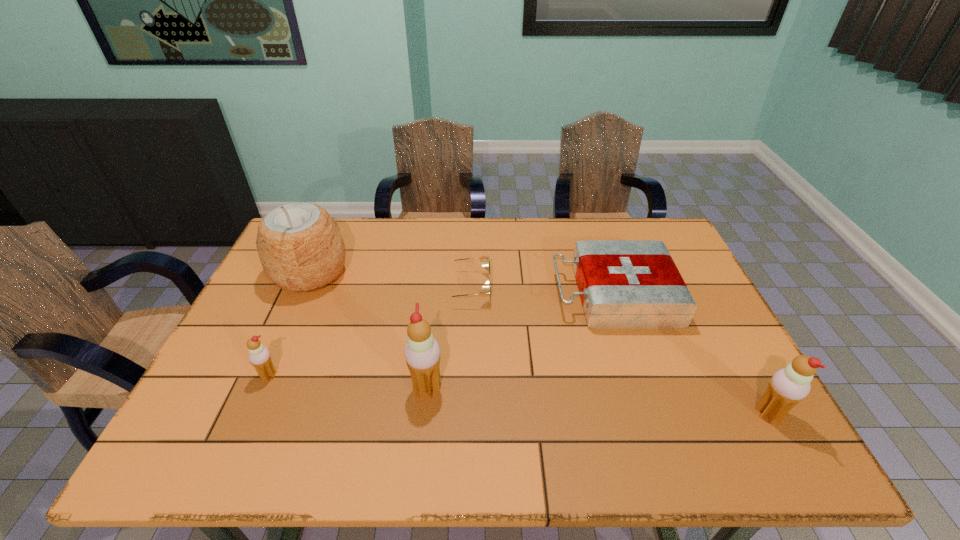
Where is `vacant space situated 0.310m at the front with a straw on the rightmost icecream`? vacant space situated 0.310m at the front with a straw on the rightmost icecream is located at coordinates (616, 414).

The height and width of the screenshot is (540, 960). I want to click on free space located at the front with a straw on the rightmost icecream, so 652,414.

Identify the location of vacant space located 0.370m at the front with a straw on the rightmost icecream. (589, 414).

The width and height of the screenshot is (960, 540). Find the location of `vacant space located on the front lenses of the shortest object`. vacant space located on the front lenses of the shortest object is located at coordinates (601, 288).

This screenshot has width=960, height=540. Find the location of `vacant area situated on the right of the tallest object`. vacant area situated on the right of the tallest object is located at coordinates (407, 274).

In order to click on vacant space situated on the front side of the first-aid kit in this screenshot , I will do `click(534, 294)`.

The height and width of the screenshot is (540, 960). Find the location of `vacant space located on the front side of the first-aid kit`. vacant space located on the front side of the first-aid kit is located at coordinates point(527,294).

I want to click on free space located on the front side of the first-aid kit, so click(x=424, y=294).

This screenshot has height=540, width=960. I want to click on object located in the far edge section of the desktop, so click(300, 246).

Where is `icecream located in the left edge section of the desktop`? This screenshot has width=960, height=540. icecream located in the left edge section of the desktop is located at coordinates coord(259,356).